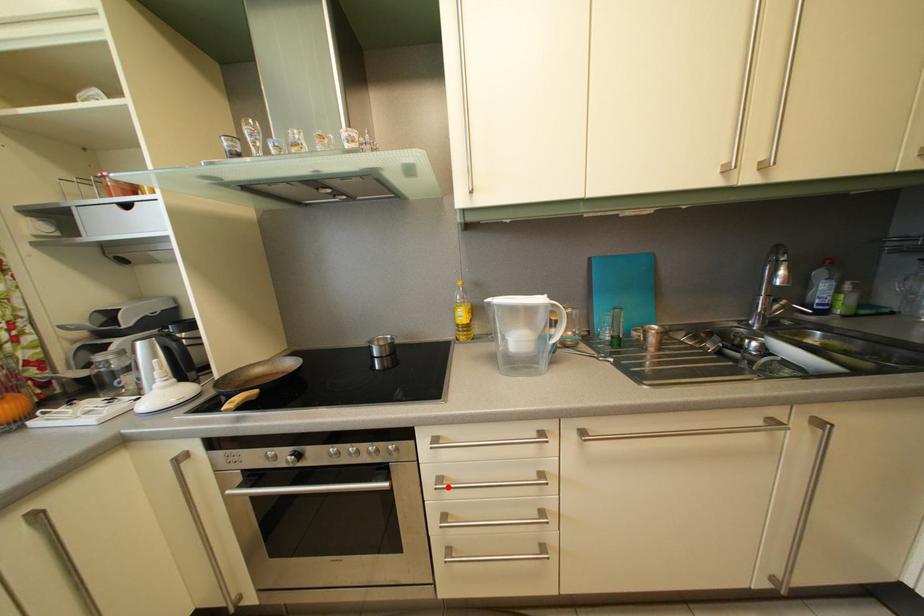
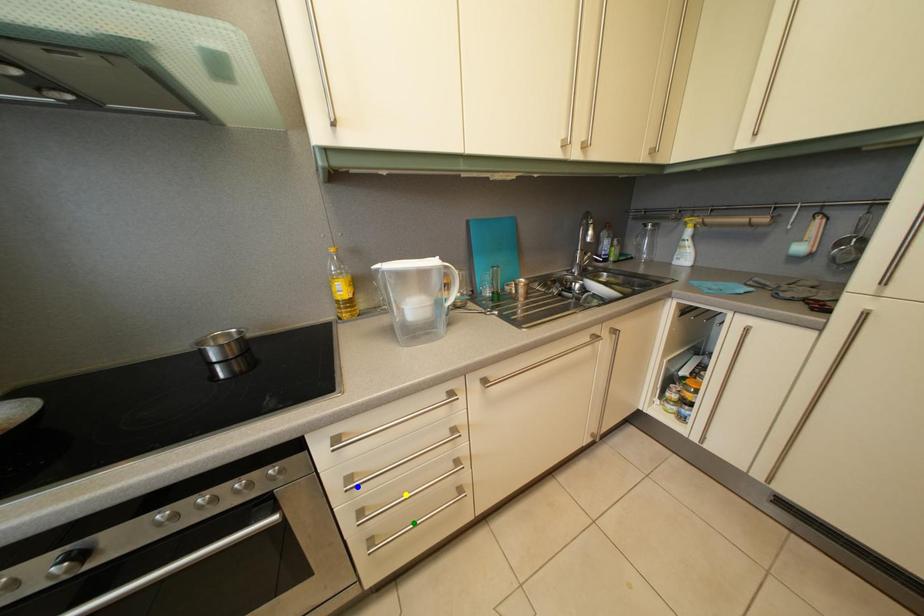
Question: I am providing you with two images of the same scene from different viewpoints. A red point is marked on the first image. You are given multiple points on the second image. Which spot in image 2 lines up with the point in image 1?

Choices:
 (A) green point
 (B) blue point
 (C) yellow point

Answer: (B)